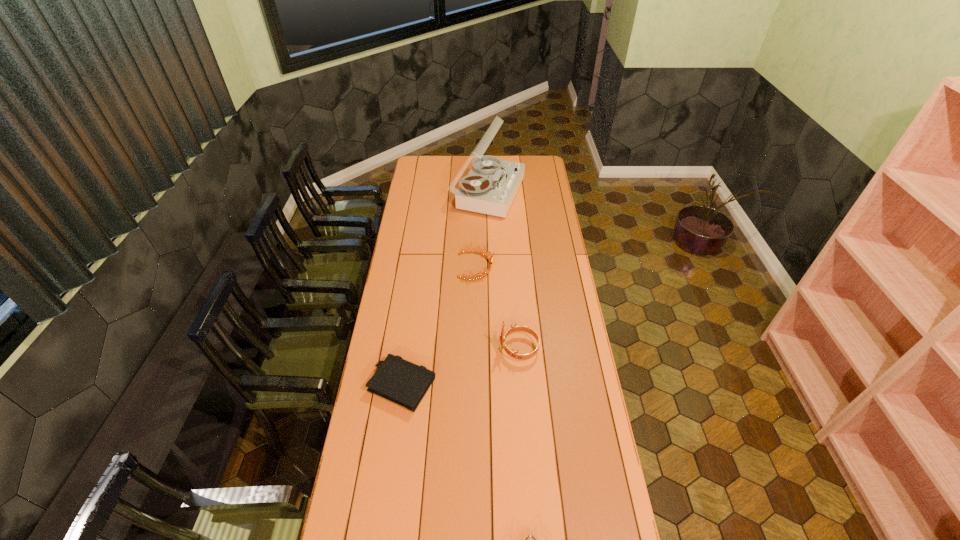
Find the location of a particular element. This screenshot has height=540, width=960. vacant region located 0.360m on the front-facing side of the fourth shortest object is located at coordinates (410, 349).

The height and width of the screenshot is (540, 960). I want to click on free space located 0.150m on the front-facing side of the second tallest tiara, so click(x=524, y=266).

I want to click on free spot located on the right of the Bible, so click(x=486, y=385).

Find the location of a particular element. The height and width of the screenshot is (540, 960). object that is at the far edge is located at coordinates (490, 187).

Find the location of `object present at the left edge`. object present at the left edge is located at coordinates (400, 381).

Find the location of a particular element. object that is at the right edge is located at coordinates (490, 187).

Where is `object located at the far right corner`? This screenshot has height=540, width=960. object located at the far right corner is located at coordinates (490, 187).

In the image, there is a desktop. Where is `vacant space at the left edge`? The width and height of the screenshot is (960, 540). vacant space at the left edge is located at coordinates (412, 246).

Where is `free space at the right edge`? free space at the right edge is located at coordinates (547, 274).

At what (x,y) coordinates should I click in order to perform the action: click on vacant area at the far left corner of the desktop. Please return your answer as a coordinate pair (x, y). Looking at the image, I should click on (414, 168).